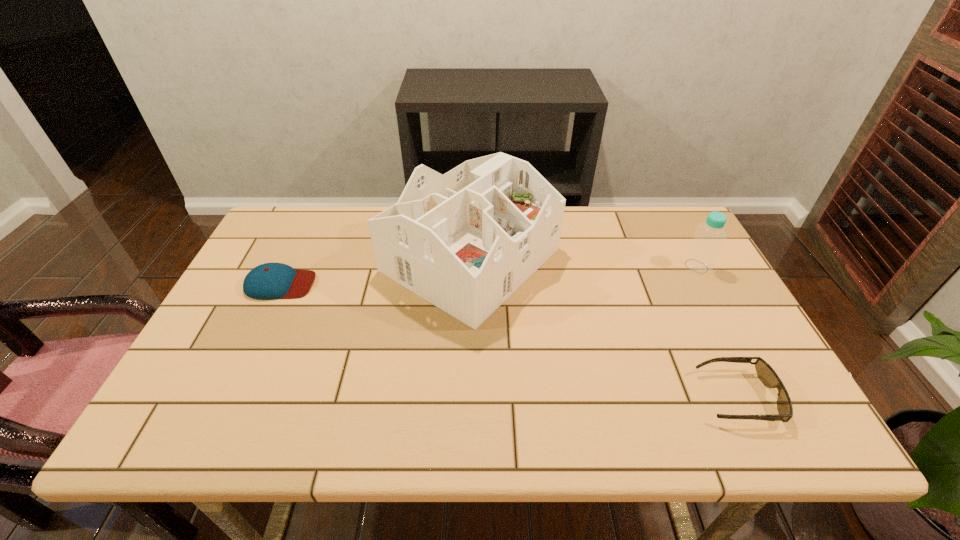
Image resolution: width=960 pixels, height=540 pixels. Identify the location of vacant space at the right edge of the desktop. (710, 325).

Locate an element on the screen. This screenshot has height=540, width=960. vacant space at the far left corner is located at coordinates (304, 206).

Locate an element on the screen. vacant space at the far right corner is located at coordinates (661, 208).

The height and width of the screenshot is (540, 960). I want to click on vacant space that's between the baseball cap and the third object from right to left, so click(375, 272).

The height and width of the screenshot is (540, 960). I want to click on free space that is in between the third shortest object and the second object from left to right, so click(584, 263).

Where is `free space between the second object from left to right and the second tallest object`? Image resolution: width=960 pixels, height=540 pixels. free space between the second object from left to right and the second tallest object is located at coordinates (584, 263).

The image size is (960, 540). Find the location of `unoccupied area between the dollhouse and the leftmost object`. unoccupied area between the dollhouse and the leftmost object is located at coordinates (375, 272).

Where is `free space that is in between the third object from right to left and the bottle`? The image size is (960, 540). free space that is in between the third object from right to left and the bottle is located at coordinates (584, 263).

The height and width of the screenshot is (540, 960). What are the coordinates of `unoccupied area between the leftmost object and the nearest object` in the screenshot? It's located at (509, 341).

Where is `free space between the baseball cap and the tallest object`? The image size is (960, 540). free space between the baseball cap and the tallest object is located at coordinates (375, 272).